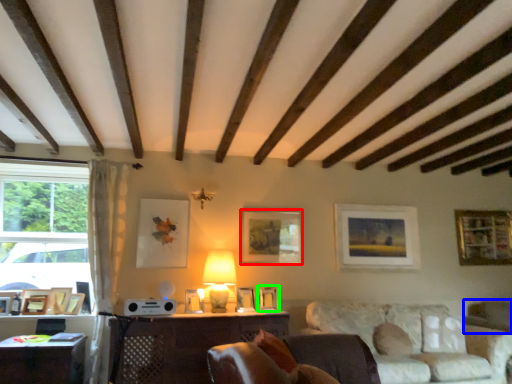
Question: Which object is the closest to the picture frame (highlighted by a red box)? Choose among these: swivel chair (highlighted by a blue box) or picture frame (highlighted by a green box).

Choices:
 (A) swivel chair
 (B) picture frame

Answer: (B)